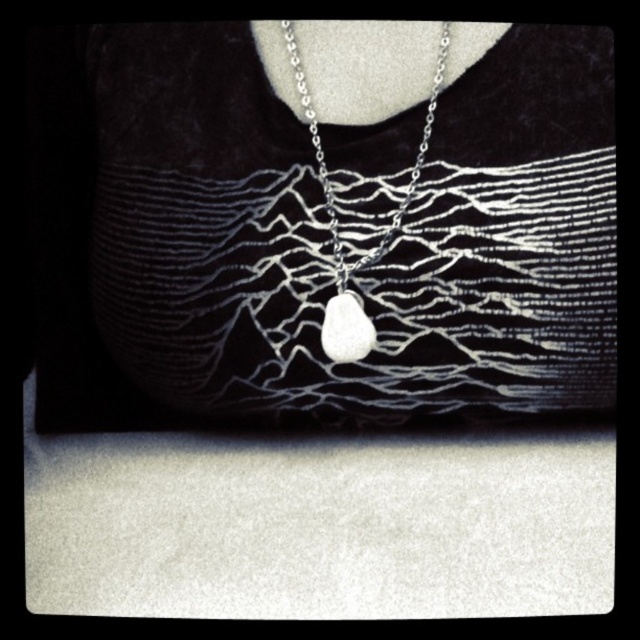
Question: Among these points, which one is farthest from the camera?

Choices:
 (A) (378, 259)
 (B) (442, 353)
 (C) (346, 349)

Answer: (B)

Question: Which object appears closest to the camera in this image?

Choices:
 (A) silver metallic necklace at center
 (B) white matte stone at center
 (C) silver metallic pendant at center

Answer: (A)

Question: Can you confirm if silver metallic necklace at center is positioned below silver metallic pendant at center?

Choices:
 (A) no
 (B) yes

Answer: (B)

Question: Can you confirm if silver metallic necklace at center is positioned to the right of silver metallic pendant at center?

Choices:
 (A) yes
 (B) no

Answer: (B)

Question: Is silver metallic necklace at center to the right of white matte stone at center from the viewer's perspective?

Choices:
 (A) yes
 (B) no

Answer: (A)

Question: Which point is farther to the camera?

Choices:
 (A) (326, 355)
 (B) (180, 173)
 (C) (330, 356)

Answer: (A)